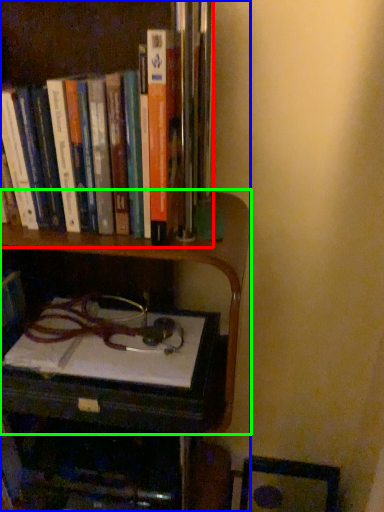
Question: Estimate the real-world distances between objects in this image. Which object is farther from book (highlighted by a red box), bookcase (highlighted by a blue box) or shelf (highlighted by a green box)?

Choices:
 (A) bookcase
 (B) shelf

Answer: (A)